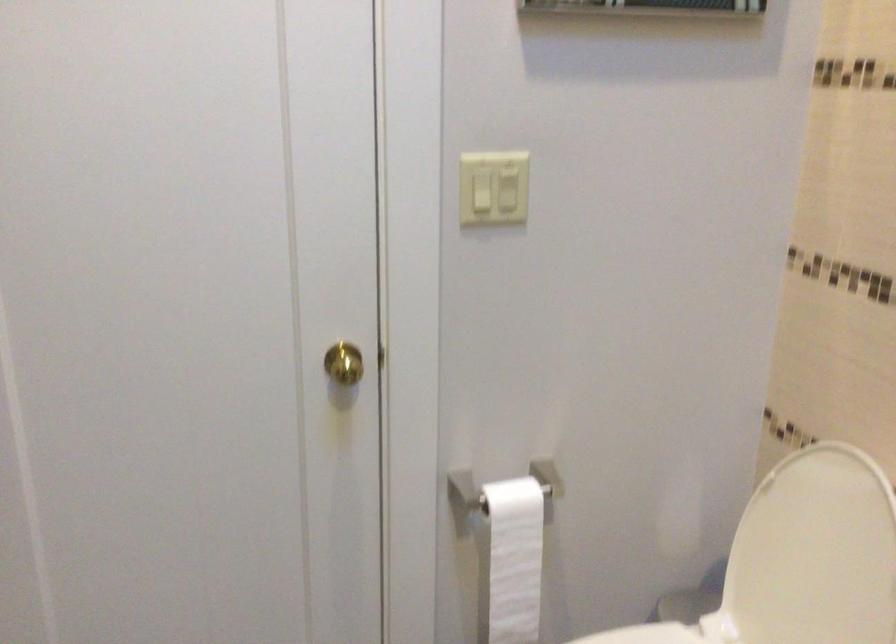
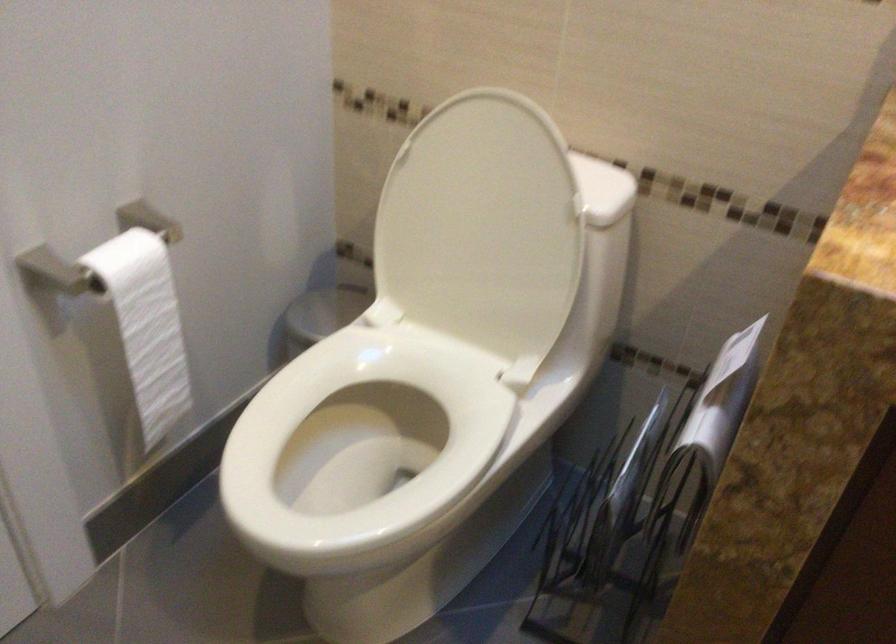
In the second image, find the point that corresponds to point (512, 550) in the first image.

(147, 325)